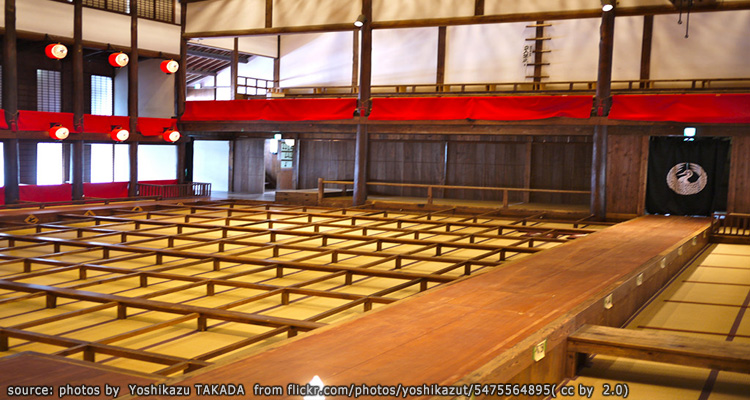
Identify the location of door. (54, 166).